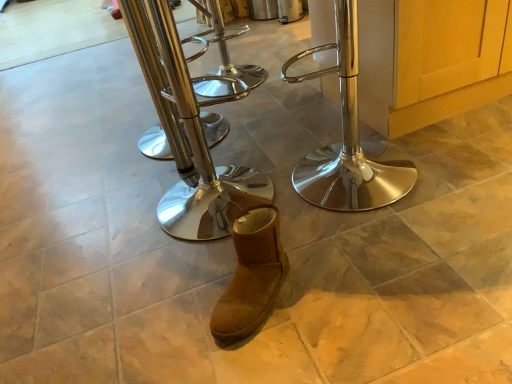
Where is `vacant area that is in front of polished metal bar stool at center, the third step stool viewed from the right`? vacant area that is in front of polished metal bar stool at center, the third step stool viewed from the right is located at coordinates (161, 180).